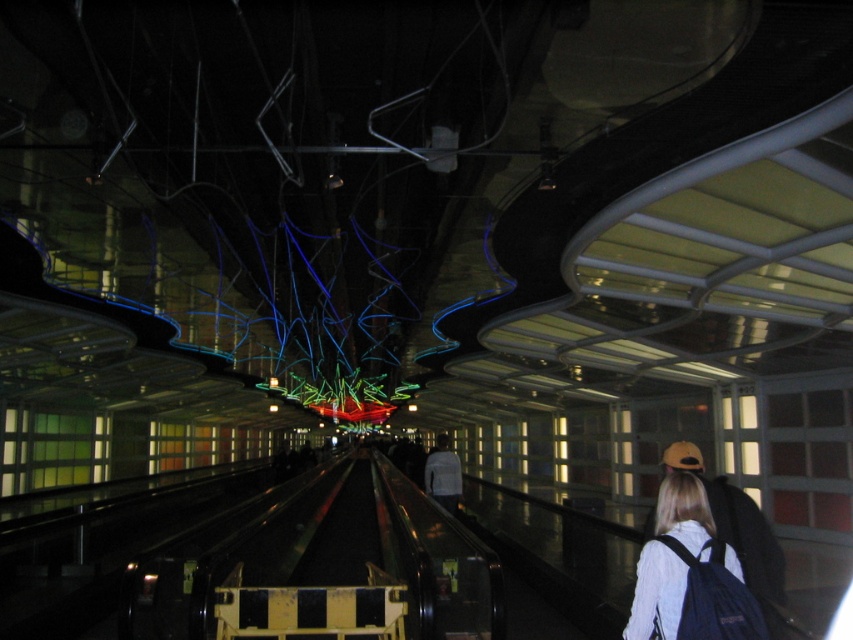
You are standing at the entrance of the underground station and want to take a photo of both point (697,486) and point (426,468). Which point should you focus on first to ensure both are in clear focus?

→ Point (697,486) is closer to the camera than point (426,468). To ensure both are in clear focus, you should focus on the closer point, which is point (697,486).

You are standing in an underground station and see a blue backpack at lower right and a white matte shirt at center. Which item is located more to the right side?

The blue backpack at lower right is more to the right side than the white matte shirt at center.